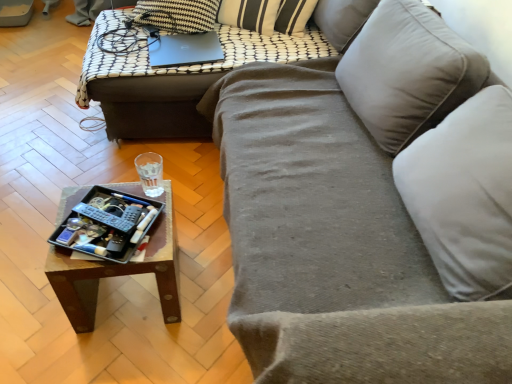
Question: Does wooden tray at center appear on the right side of wooden tray at center?

Choices:
 (A) yes
 (B) no

Answer: (A)

Question: Is wooden tray at center to the left of wooden tray at center from the viewer's perspective?

Choices:
 (A) no
 (B) yes

Answer: (A)

Question: Considering the relative positions of wooden tray at center and wooden tray at center in the image provided, is wooden tray at center in front of wooden tray at center?

Choices:
 (A) no
 (B) yes

Answer: (A)

Question: From a real-world perspective, is wooden tray at center physically below wooden tray at center?

Choices:
 (A) yes
 (B) no

Answer: (B)

Question: Would you say wooden tray at center contains wooden tray at center?

Choices:
 (A) yes
 (B) no

Answer: (B)

Question: From a real-world perspective, relative to velvet gray couch at center, is wooden tray at center vertically above or below?

Choices:
 (A) above
 (B) below

Answer: (B)

Question: Considering their positions, is wooden tray at center located in front of or behind velvet gray couch at center?

Choices:
 (A) front
 (B) behind

Answer: (B)

Question: Does point (115, 268) appear closer or farther from the camera than point (331, 168)?

Choices:
 (A) closer
 (B) farther

Answer: (A)

Question: Is wooden tray at center to the left or to the right of velvet gray couch at center in the image?

Choices:
 (A) right
 (B) left

Answer: (B)

Question: In the image, is metallic tray at lower left positioned in front of or behind matte black laptop at upper center?

Choices:
 (A) behind
 (B) front

Answer: (B)

Question: In terms of size, does metallic tray at lower left appear bigger or smaller than matte black laptop at upper center?

Choices:
 (A) big
 (B) small

Answer: (B)

Question: From their relative heights in the image, would you say metallic tray at lower left is taller or shorter than matte black laptop at upper center?

Choices:
 (A) short
 (B) tall

Answer: (A)

Question: Do you think metallic tray at lower left is within matte black laptop at upper center, or outside of it?

Choices:
 (A) outside
 (B) inside

Answer: (A)

Question: Would you say black plastic remote at lower left is inside or outside matte black laptop at upper center?

Choices:
 (A) inside
 (B) outside

Answer: (B)

Question: From a real-world perspective, relative to matte black laptop at upper center, is black plastic remote at lower left vertically above or below?

Choices:
 (A) above
 (B) below

Answer: (B)